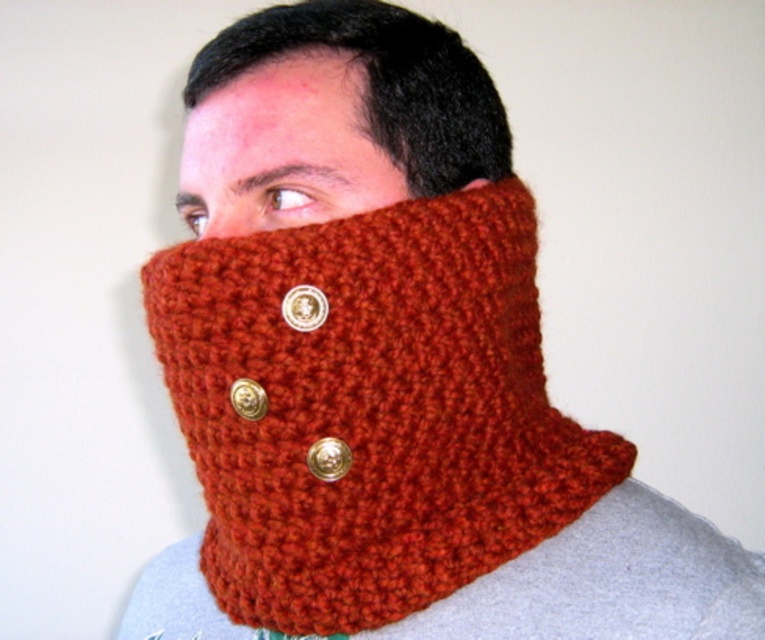
Based on the photo, is orange knitted scarf at center taller than matte orange knit at center?

Yes, orange knitted scarf at center is taller than matte orange knit at center.

Which of these two, orange knitted scarf at center or matte orange knit at center, stands shorter?

Standing shorter between the two is matte orange knit at center.

Which is behind, point (321, 118) or point (239, 230)?

The point (239, 230) is behind.

Identify the location of orange knitted scarf at center. (337, 113).

Who is shorter, rust knitted scarf at center or matte orange knit at center?

matte orange knit at center is shorter.

Who is positioned more to the left, rust knitted scarf at center or matte orange knit at center?

matte orange knit at center

At what (x,y) coordinates should I click in order to perform the action: click on rust knitted scarf at center. Please return your answer as a coordinate pair (x, y). Image resolution: width=765 pixels, height=640 pixels. Looking at the image, I should click on 369,408.

You are a GUI agent. You are given a task and a screenshot of the screen. Output one action in this format:
    pyautogui.click(x=<x>, y=<y>)
    Task: Click on the rust knitted scarf at center
    The width and height of the screenshot is (765, 640).
    Given the screenshot: What is the action you would take?
    (369, 408)

Does rust knitted scarf at center have a lesser width compared to orange knitted scarf at center?

Incorrect, rust knitted scarf at center's width is not less than orange knitted scarf at center's.

Which is behind, point (392, 371) or point (314, 192)?

The point (314, 192) is more distant.

What do you see at coordinates (369, 408) in the screenshot? This screenshot has width=765, height=640. I see `rust knitted scarf at center` at bounding box center [369, 408].

I want to click on rust knitted scarf at center, so click(x=369, y=408).